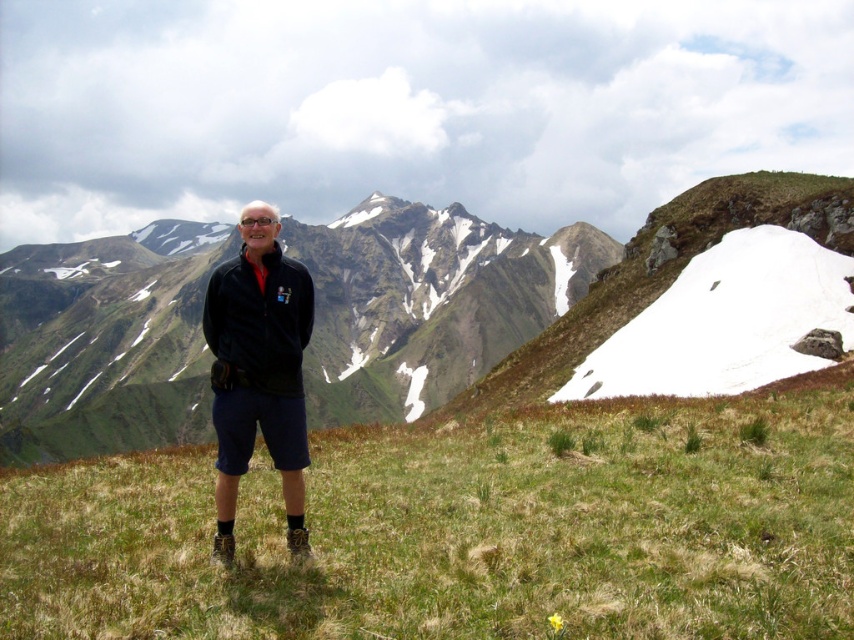
Is green grassy at center to the right of green grassy hillside at center from the viewer's perspective?

Yes, green grassy at center is to the right of green grassy hillside at center.

Is green grassy at center above green grassy hillside at center?

Actually, green grassy at center is below green grassy hillside at center.

This screenshot has height=640, width=854. I want to click on green grassy at center, so click(x=461, y=531).

The width and height of the screenshot is (854, 640). I want to click on green grassy hillside at center, so click(506, 291).

Can you confirm if green grassy hillside at center is positioned below black matte jacket at center?

No.

At what (x,y) coordinates should I click in order to perform the action: click on green grassy hillside at center. Please return your answer as a coordinate pair (x, y). The image size is (854, 640). Looking at the image, I should click on (506, 291).

Consider the image. Between green grassy at center and black matte jacket at center, which one has more height?

With more height is black matte jacket at center.

Which is behind, point (255, 609) or point (284, 340)?

Point (284, 340)

Between point (582, 410) and point (220, 381), which one is positioned in front?

Point (220, 381)

What are the coordinates of `green grassy at center` in the screenshot? It's located at (461, 531).